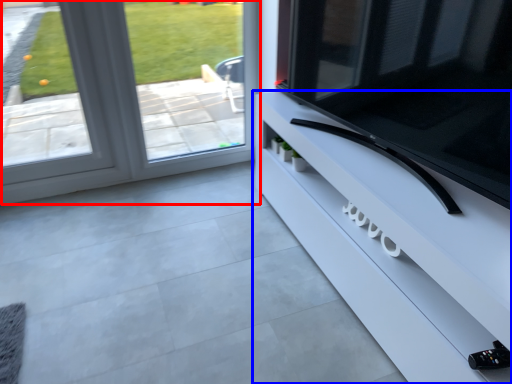
Question: Which object is further to the camera taking this photo, window (highlighted by a red box) or furniture (highlighted by a blue box)?

Choices:
 (A) window
 (B) furniture

Answer: (A)